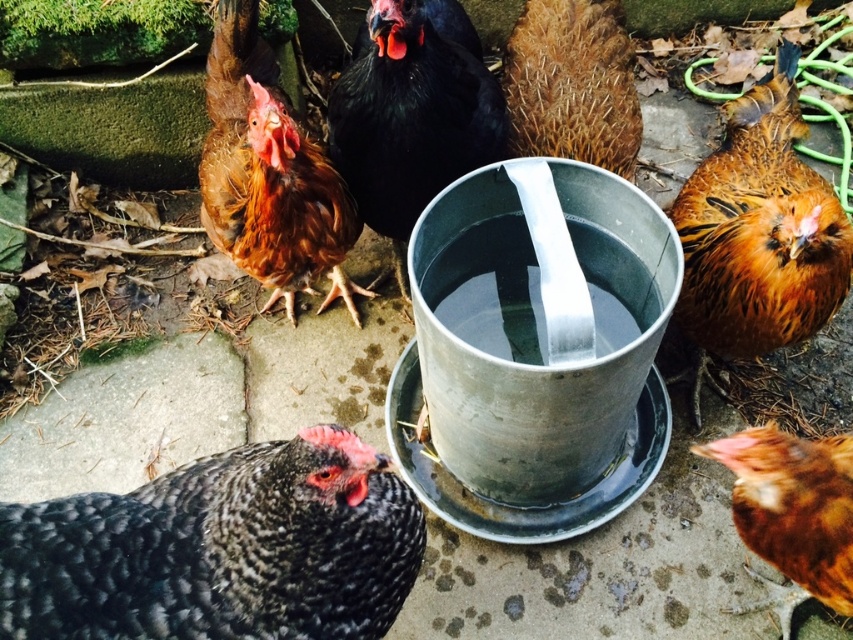
Question: Which of the following is the farthest from the observer?

Choices:
 (A) (477, 164)
 (B) (250, 225)
 (C) (712, 332)

Answer: (A)

Question: Which of the following is the farthest from the observer?

Choices:
 (A) (257, 170)
 (B) (802, 572)

Answer: (A)

Question: Estimate the real-world distances between objects in this image. Which object is closer to the brown textured feathers at center?

Choices:
 (A) brown speckled feathers at lower right
 (B) brown speckled feathers at right
 (C) black glossy chicken at center

Answer: (C)

Question: Is brown speckled feathers at right above brown textured feathers at center?

Choices:
 (A) yes
 (B) no

Answer: (B)

Question: Is brown speckled feathers at right to the left of brown speckled feathers at lower right from the viewer's perspective?

Choices:
 (A) yes
 (B) no

Answer: (B)

Question: Is brown textured feathers at center bigger than brown speckled feathers at lower right?

Choices:
 (A) yes
 (B) no

Answer: (A)